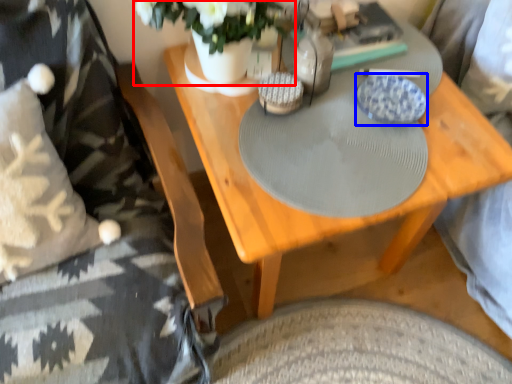
Question: Which point is closer to the camera, floral arrangement (highlighted by a red box) or plate (highlighted by a blue box)?

Choices:
 (A) floral arrangement
 (B) plate

Answer: (A)